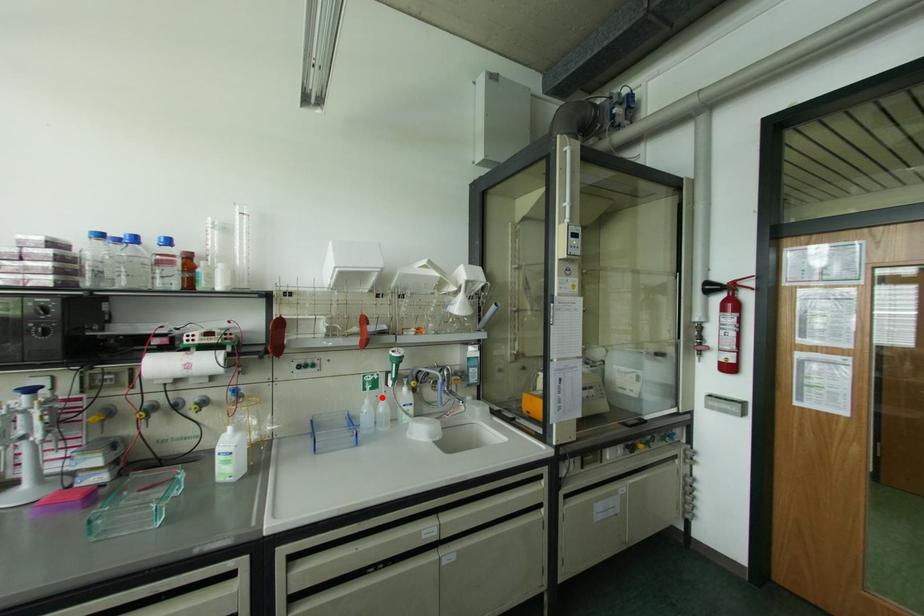
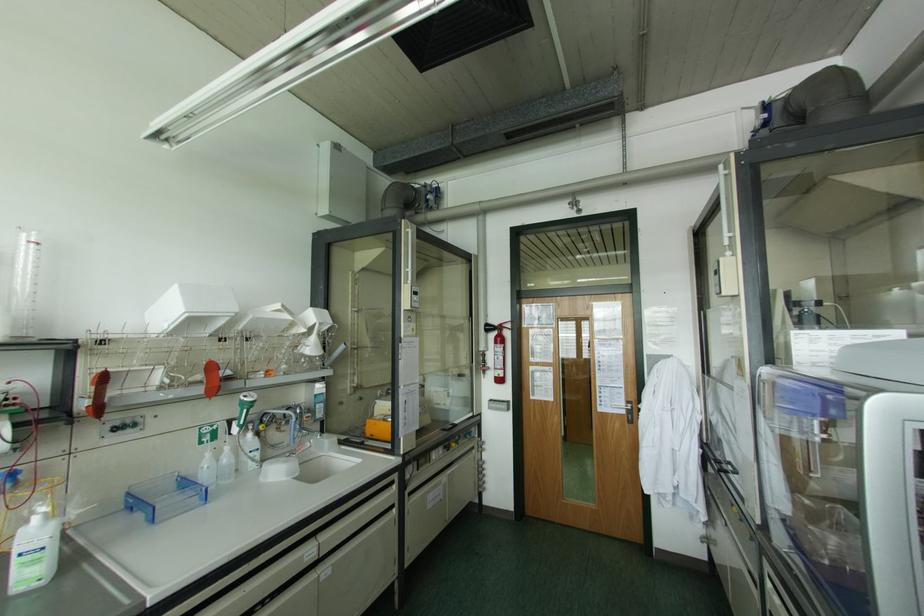
The point at the highlighted location is marked in the first image. Where is the corresponding point in the second image?

(226, 448)